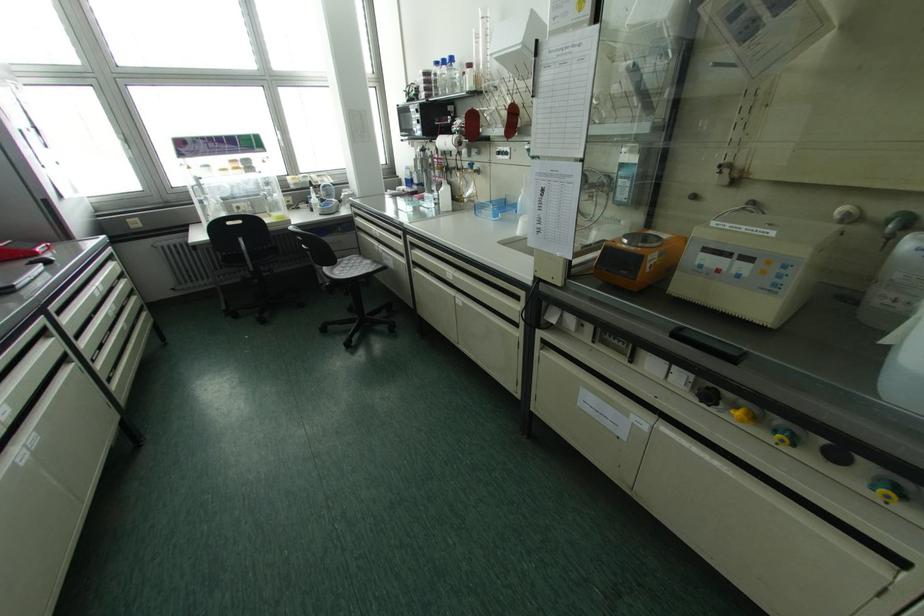
Find where to turn the black control knob. Please return your answer as a coordinate pair (x, y).

(708, 395)